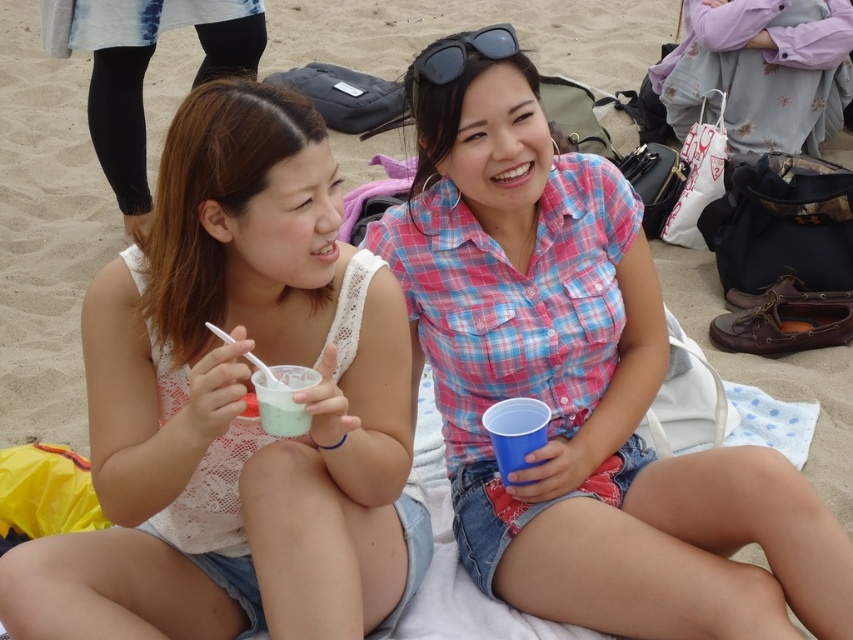
You are designing a layout for a beach scene poster and want to place the pink plaid shirt at center and the black plastic goggles at upper center. Based on their sizes, which object should be placed higher up on the poster to maintain visual balance?

The pink plaid shirt at center should be placed higher up on the poster because it has a greater height compared to the black plastic goggles at upper center, which would help balance their sizes in the design.